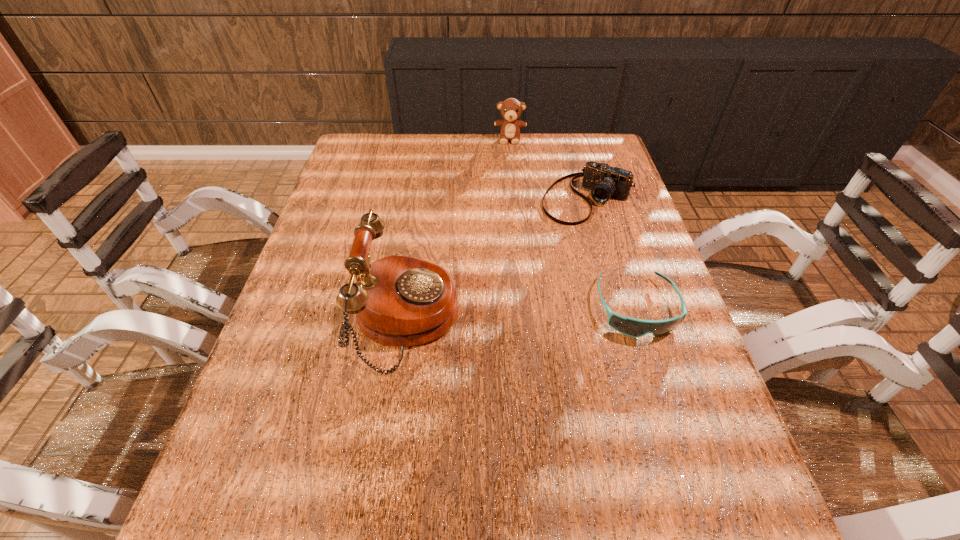
Find the location of a particular element. vacant space located 0.240m on the front-facing side of the camera is located at coordinates pyautogui.click(x=523, y=272).

At what (x,y) coordinates should I click in order to perform the action: click on vacant space situated on the front-facing side of the camera. Please return your answer as a coordinate pair (x, y). This screenshot has width=960, height=540. Looking at the image, I should click on (491, 310).

At what (x,y) coordinates should I click in order to perform the action: click on blank space located 0.310m on the face of the teddy bear. Please return your answer as a coordinate pair (x, y). Looking at the image, I should click on (508, 199).

Identify the location of vacant space situated on the face of the teddy bear. (508, 178).

Locate an element on the screen. The image size is (960, 540). vacant region located on the face of the teddy bear is located at coordinates (509, 176).

Locate an element on the screen. object that is at the far edge is located at coordinates (511, 109).

Locate an element on the screen. The image size is (960, 540). sunglasses that is at the right edge is located at coordinates (633, 327).

This screenshot has height=540, width=960. What are the coordinates of `camera located at the right edge` in the screenshot? It's located at (604, 181).

You are a GUI agent. You are given a task and a screenshot of the screen. Output one action in this format:
    pyautogui.click(x=<x>, y=<y>)
    Task: Click on the vacant space at the far edge of the desktop
    Image resolution: width=960 pixels, height=540 pixels.
    Given the screenshot: What is the action you would take?
    pyautogui.click(x=459, y=142)

You are a GUI agent. You are given a task and a screenshot of the screen. Output one action in this format:
    pyautogui.click(x=<x>, y=<y>)
    Task: Click on the vacant space at the near edge of the desktop
    Image resolution: width=960 pixels, height=540 pixels.
    Given the screenshot: What is the action you would take?
    pyautogui.click(x=536, y=437)